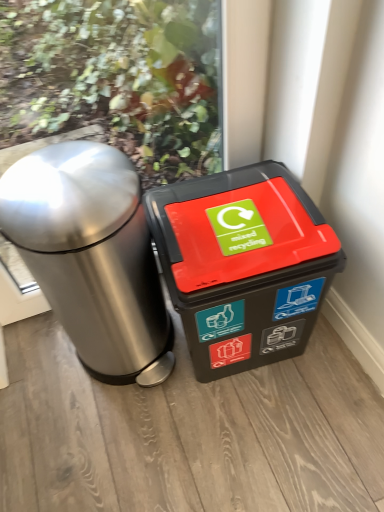
Question: Does brushed metal trash can at left, acting as the 1th waste container starting from the left, have a smaller size compared to black plastic recycling bin at center, marked as the first waste container in a right-to-left arrangement?

Choices:
 (A) no
 (B) yes

Answer: (A)

Question: Is black plastic recycling bin at center, marked as the first waste container in a right-to-left arrangement, inside brushed metal trash can at left, acting as the 1th waste container starting from the left?

Choices:
 (A) yes
 (B) no

Answer: (B)

Question: Considering the relative positions of brushed metal trash can at left, acting as the 1th waste container starting from the left, and black plastic recycling bin at center, marked as the first waste container in a right-to-left arrangement, in the image provided, is brushed metal trash can at left, acting as the 1th waste container starting from the left, to the left of black plastic recycling bin at center, marked as the first waste container in a right-to-left arrangement, from the viewer's perspective?

Choices:
 (A) no
 (B) yes

Answer: (B)

Question: Can you confirm if brushed metal trash can at left, acting as the 1th waste container starting from the left, is bigger than black plastic recycling bin at center, marked as the first waste container in a right-to-left arrangement?

Choices:
 (A) no
 (B) yes

Answer: (B)

Question: Considering the relative sizes of brushed metal trash can at left, which is the second waste container in right-to-left order, and black plastic recycling bin at center, the 2th waste container positioned from the left, in the image provided, is brushed metal trash can at left, which is the second waste container in right-to-left order, shorter than black plastic recycling bin at center, the 2th waste container positioned from the left,?

Choices:
 (A) yes
 (B) no

Answer: (B)

Question: Is brushed metal trash can at left, acting as the 1th waste container starting from the left, at the right side of black plastic recycling bin at center, the 2th waste container positioned from the left?

Choices:
 (A) yes
 (B) no

Answer: (B)

Question: Is black plastic recycling bin at center, the 2th waste container positioned from the left, far away from brushed metal trash can at left, which is the second waste container in right-to-left order?

Choices:
 (A) no
 (B) yes

Answer: (A)

Question: Is the depth of black plastic recycling bin at center, marked as the first waste container in a right-to-left arrangement, greater than that of brushed metal trash can at left, acting as the 1th waste container starting from the left?

Choices:
 (A) no
 (B) yes

Answer: (B)

Question: Is black plastic recycling bin at center, the 2th waste container positioned from the left, oriented away from brushed metal trash can at left, acting as the 1th waste container starting from the left?

Choices:
 (A) yes
 (B) no

Answer: (B)

Question: Considering the relative positions of black plastic recycling bin at center, the 2th waste container positioned from the left, and brushed metal trash can at left, acting as the 1th waste container starting from the left, in the image provided, is black plastic recycling bin at center, the 2th waste container positioned from the left, to the left of brushed metal trash can at left, acting as the 1th waste container starting from the left, from the viewer's perspective?

Choices:
 (A) no
 (B) yes

Answer: (A)

Question: Can you confirm if black plastic recycling bin at center, marked as the first waste container in a right-to-left arrangement, is smaller than brushed metal trash can at left, acting as the 1th waste container starting from the left?

Choices:
 (A) yes
 (B) no

Answer: (A)

Question: Is black plastic recycling bin at center, the 2th waste container positioned from the left, beside brushed metal trash can at left, which is the second waste container in right-to-left order?

Choices:
 (A) no
 (B) yes

Answer: (A)

Question: Looking at the image, does black plastic recycling bin at center, marked as the first waste container in a right-to-left arrangement, seem bigger or smaller compared to brushed metal trash can at left, which is the second waste container in right-to-left order?

Choices:
 (A) big
 (B) small

Answer: (B)